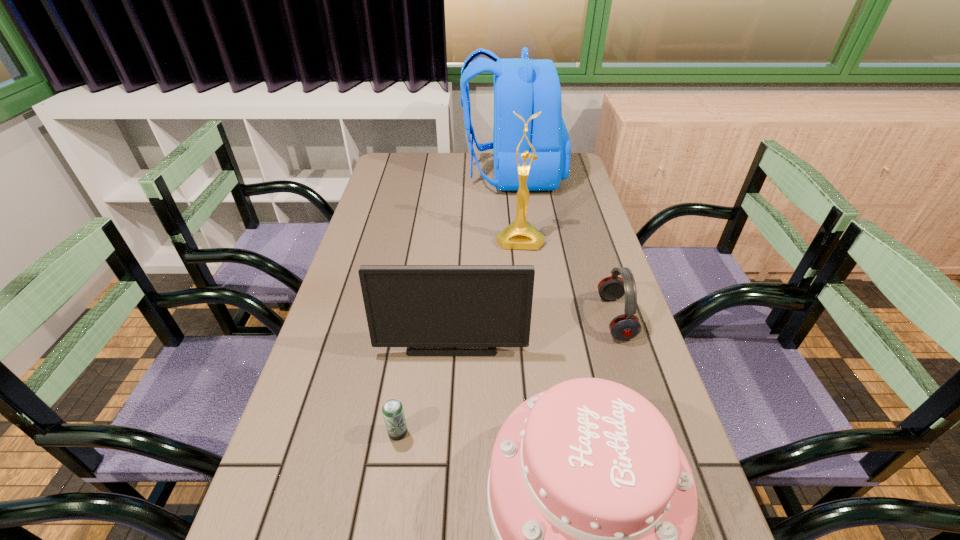
This screenshot has width=960, height=540. I want to click on free spot that satisfies the following two spatial constraints: 1. on the back of the backpack; 2. on the screen side of the computer monitor, so click(532, 337).